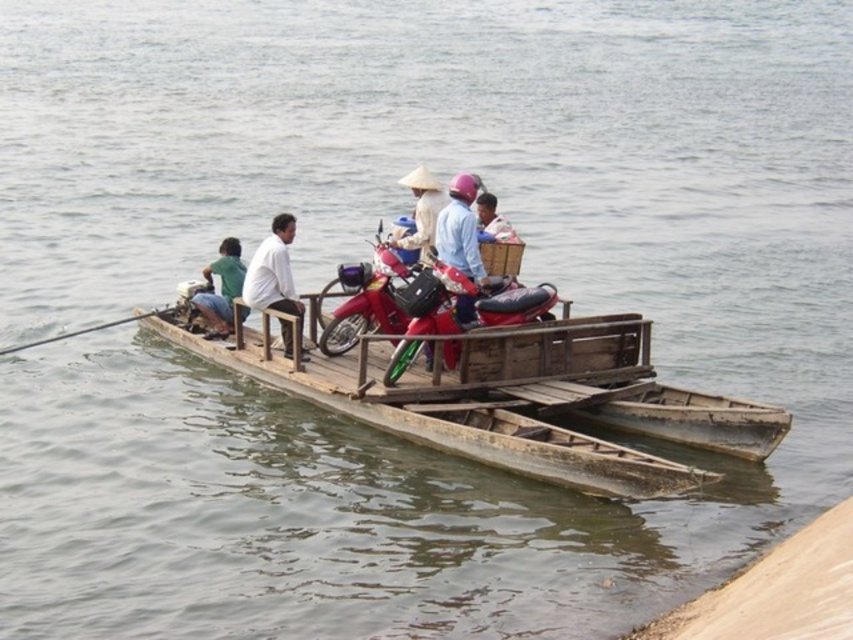
Question: Which point is closer to the camera?

Choices:
 (A) white matte shirt at center
 (B) light brown wooden basket at center
 (C) wooden boat at center

Answer: (C)

Question: Is shiny red motorcycle at center below light brown wooden basket at center?

Choices:
 (A) yes
 (B) no

Answer: (A)

Question: Which point is farther to the camera?

Choices:
 (A) (318, 307)
 (B) (415, 300)
 (C) (492, 196)

Answer: (A)

Question: Is shiny red motorcycle at center to the left of white matte shirt at center from the viewer's perspective?

Choices:
 (A) yes
 (B) no

Answer: (B)

Question: Which point appears closest to the camera in this image?

Choices:
 (A) (374, 321)
 (B) (433, 244)

Answer: (A)

Question: Does shiny red motorcycle at center appear over light brown wooden basket at center?

Choices:
 (A) yes
 (B) no

Answer: (B)